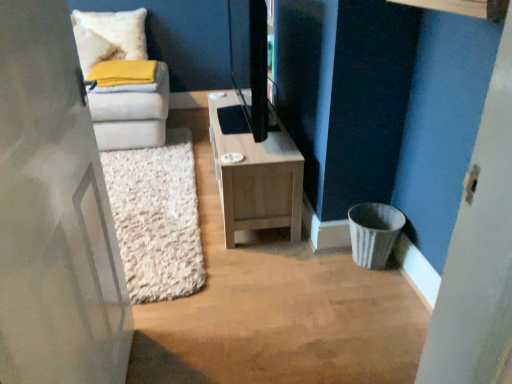
Question: Considering the relative sizes of white soft pillow at upper left and light wood/texture tv stand at center in the image provided, is white soft pillow at upper left shorter than light wood/texture tv stand at center?

Choices:
 (A) yes
 (B) no

Answer: (A)

Question: From a real-world perspective, is white soft pillow at upper left physically above light wood/texture tv stand at center?

Choices:
 (A) no
 (B) yes

Answer: (B)

Question: Is white soft pillow at upper left wider than light wood/texture tv stand at center?

Choices:
 (A) no
 (B) yes

Answer: (A)

Question: Is the position of white soft pillow at upper left more distant than that of light wood/texture tv stand at center?

Choices:
 (A) no
 (B) yes

Answer: (B)

Question: Could you tell me if white soft pillow at upper left is facing light wood/texture tv stand at center?

Choices:
 (A) no
 (B) yes

Answer: (A)

Question: From a real-world perspective, is white matte door at left physically located above or below light wood/texture tv stand at center?

Choices:
 (A) below
 (B) above

Answer: (B)

Question: Considering the positions of point (51, 357) and point (287, 142), is point (51, 357) closer or farther from the camera than point (287, 142)?

Choices:
 (A) closer
 (B) farther

Answer: (A)

Question: From their relative heights in the image, would you say white matte door at left is taller or shorter than light wood/texture tv stand at center?

Choices:
 (A) short
 (B) tall

Answer: (B)

Question: Is white matte door at left wider or thinner than light wood/texture tv stand at center?

Choices:
 (A) wide
 (B) thin

Answer: (B)

Question: From a real-world perspective, is white soft pillow at upper left above or below light wood/texture tv stand at center?

Choices:
 (A) above
 (B) below

Answer: (A)

Question: Is white soft pillow at upper left in front of or behind light wood/texture tv stand at center in the image?

Choices:
 (A) front
 (B) behind

Answer: (B)

Question: Is white soft pillow at upper left spatially inside light wood/texture tv stand at center, or outside of it?

Choices:
 (A) inside
 (B) outside

Answer: (B)

Question: In terms of width, does white soft pillow at upper left look wider or thinner when compared to light wood/texture tv stand at center?

Choices:
 (A) wide
 (B) thin

Answer: (B)

Question: Considering the relative positions of light wood/texture tv stand at center and white matte door at left in the image provided, is light wood/texture tv stand at center to the left or to the right of white matte door at left?

Choices:
 (A) right
 (B) left

Answer: (A)

Question: From their relative heights in the image, would you say light wood/texture tv stand at center is taller or shorter than white matte door at left?

Choices:
 (A) tall
 (B) short

Answer: (B)